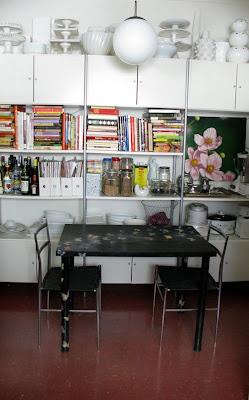
Where is `chairs`? This screenshot has width=249, height=400. chairs is located at coordinates (88, 275), (190, 278).